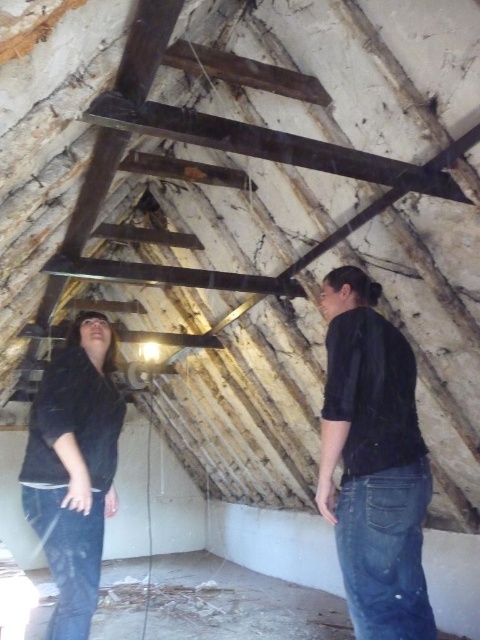
Question: Is black matte shirt at center above black matte jacket at lower left?

Choices:
 (A) yes
 (B) no

Answer: (A)

Question: From the image, what is the correct spatial relationship of black matte shirt at center in relation to black matte jacket at lower left?

Choices:
 (A) left
 (B) right

Answer: (B)

Question: Which of the following is the farthest from the observer?

Choices:
 (A) black matte jacket at lower left
 (B) black matte shirt at center

Answer: (A)

Question: Can you confirm if black matte shirt at center is thinner than black matte jacket at lower left?

Choices:
 (A) no
 (B) yes

Answer: (A)

Question: Which point is closer to the camera?

Choices:
 (A) (75, 460)
 (B) (388, 474)

Answer: (B)